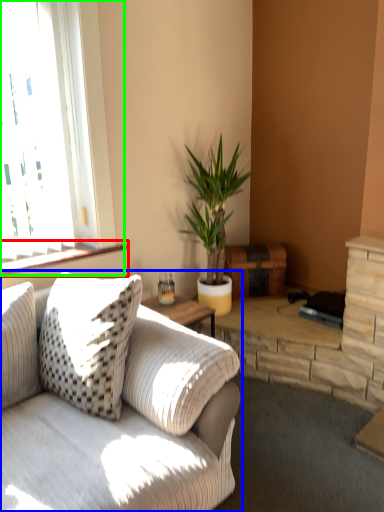
Question: Which object is the closest to the window sill (highlighted by a red box)? Choose among these: studio couch (highlighted by a blue box) or window (highlighted by a green box).

Choices:
 (A) studio couch
 (B) window

Answer: (B)